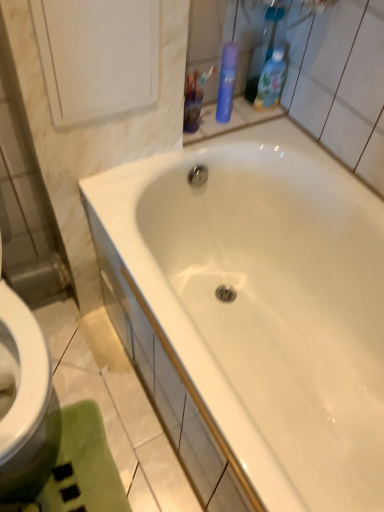
I want to click on free space above green plush bath mat at lower left (from a real-world perspective), so click(x=58, y=464).